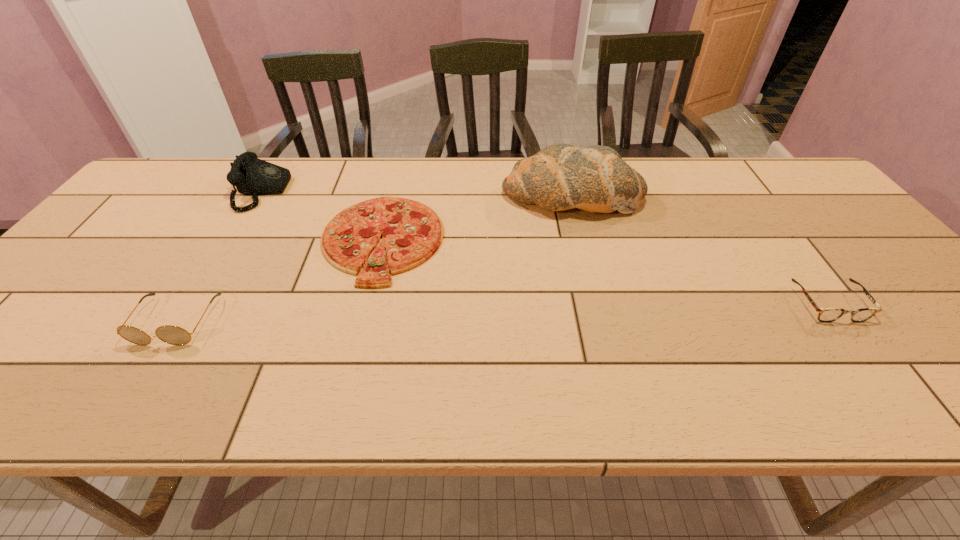
Find the location of `vacant space located 0.120m on the lenses of the sunglasses`. vacant space located 0.120m on the lenses of the sunglasses is located at coordinates (128, 400).

This screenshot has height=540, width=960. Find the location of `vacant region located on the frame of the spectacles`. vacant region located on the frame of the spectacles is located at coordinates (887, 383).

Where is `vacant position located on the back of the shortest object`? Image resolution: width=960 pixels, height=540 pixels. vacant position located on the back of the shortest object is located at coordinates (401, 161).

Where is `bread that is at the far edge`? The image size is (960, 540). bread that is at the far edge is located at coordinates (559, 177).

Locate an element on the screen. This screenshot has height=540, width=960. telephone present at the far edge is located at coordinates (252, 176).

I want to click on pizza located in the far edge section of the desktop, so click(412, 232).

You are a GUI agent. You are given a task and a screenshot of the screen. Output one action in this format:
    pyautogui.click(x=<x>, y=<y>)
    Task: Click on the object that is at the right edge
    This screenshot has height=540, width=960.
    Given the screenshot: What is the action you would take?
    pyautogui.click(x=825, y=314)

In the image, there is a desktop. Where is `free space at the far edge`? The image size is (960, 540). free space at the far edge is located at coordinates (462, 166).

This screenshot has width=960, height=540. I want to click on vacant space at the near edge of the desktop, so click(x=706, y=389).

This screenshot has width=960, height=540. In the image, there is a desktop. What are the coordinates of `free space at the left edge` in the screenshot? It's located at click(x=2, y=361).